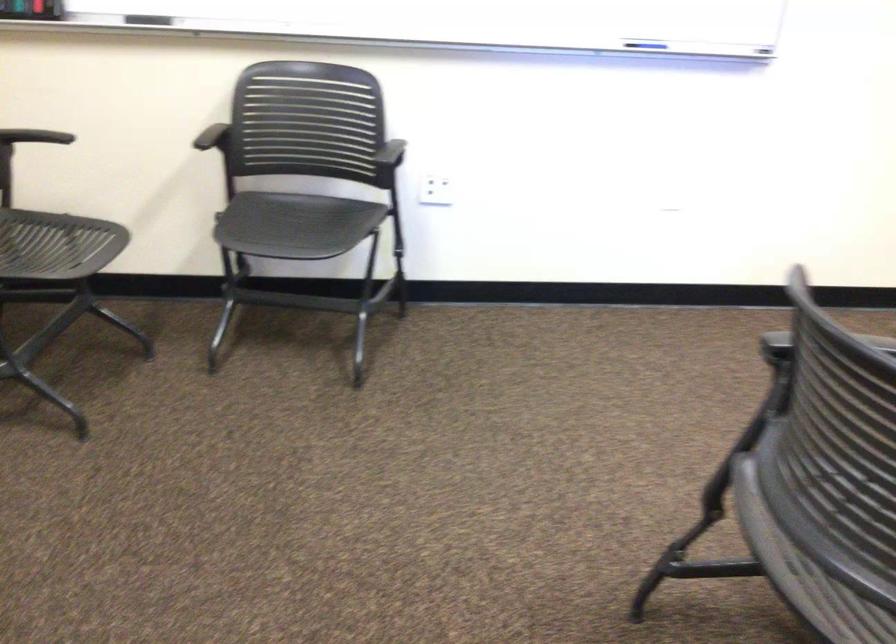
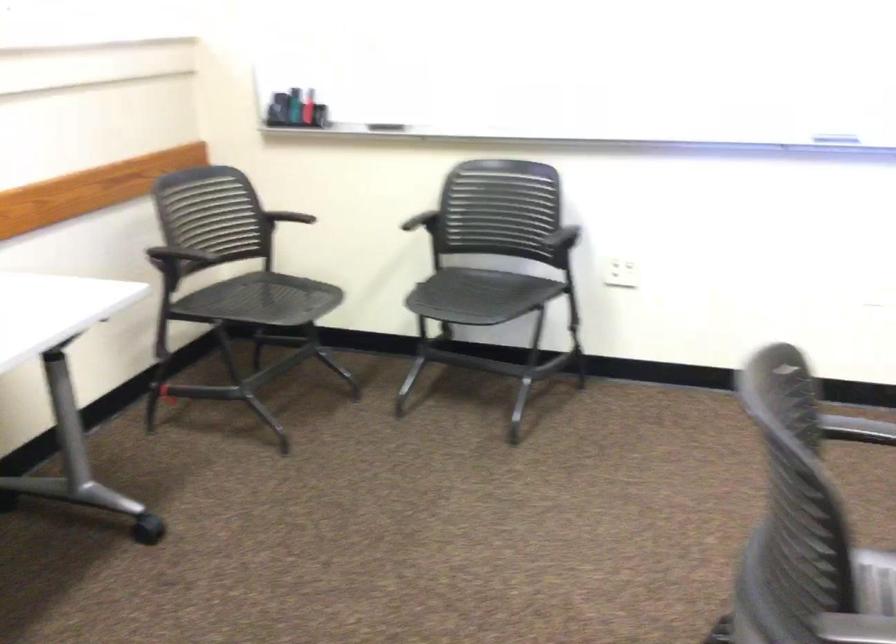
Question: The first image is from the beginning of the video and the second image is from the end. How did the camera likely rotate when shooting the video?

Choices:
 (A) Left
 (B) Right
 (C) Up
 (D) Down

Answer: (A)